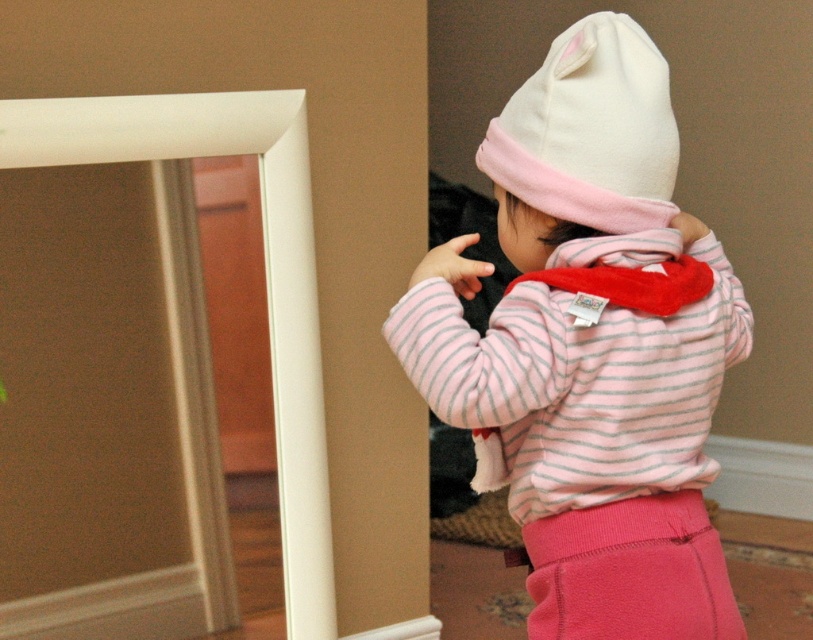
Looking at this image, does pink fleece hat at upper right have a lesser width compared to pink fleece pants at lower right?

Incorrect, pink fleece hat at upper right's width is not less than pink fleece pants at lower right's.

Describe the element at coordinates (592, 346) in the screenshot. I see `pink fleece hat at upper right` at that location.

You are a GUI agent. You are given a task and a screenshot of the screen. Output one action in this format:
    pyautogui.click(x=<x>, y=<y>)
    Task: Click on the pink fleece hat at upper right
    This screenshot has height=640, width=813.
    Given the screenshot: What is the action you would take?
    coord(592,346)

Can you confirm if white fleece hat at upper right is bigger than pink fleece pants at lower right?

Yes.

Does white fleece hat at upper right appear on the right side of pink fleece pants at lower right?

Incorrect, white fleece hat at upper right is not on the right side of pink fleece pants at lower right.

Is point (616, 52) farther from viewer compared to point (638, 552)?

No, (616, 52) is closer to viewer.

You are a GUI agent. You are given a task and a screenshot of the screen. Output one action in this format:
    pyautogui.click(x=<x>, y=<y>)
    Task: Click on the white fleece hat at upper right
    This screenshot has width=813, height=640.
    Given the screenshot: What is the action you would take?
    pyautogui.click(x=590, y=131)

Does pink fleece hat at upper right have a greater height compared to white fleece hat at upper right?

Yes, pink fleece hat at upper right is taller than white fleece hat at upper right.

Is pink fleece hat at upper right thinner than white fleece hat at upper right?

In fact, pink fleece hat at upper right might be wider than white fleece hat at upper right.

At what (x,y) coordinates should I click in order to perform the action: click on pink fleece hat at upper right. Please return your answer as a coordinate pair (x, y). Looking at the image, I should click on 592,346.

You are a GUI agent. You are given a task and a screenshot of the screen. Output one action in this format:
    pyautogui.click(x=<x>, y=<y>)
    Task: Click on the pink fleece hat at upper right
    The height and width of the screenshot is (640, 813).
    Given the screenshot: What is the action you would take?
    pyautogui.click(x=592, y=346)